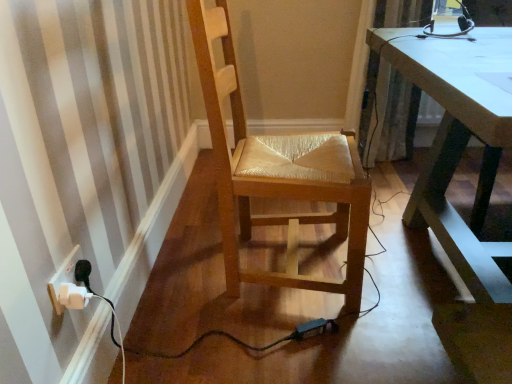
Question: Considering the relative sizes of wooden woven seat at center and textured beige curtain at upper right in the image provided, is wooden woven seat at center wider than textured beige curtain at upper right?

Choices:
 (A) yes
 (B) no

Answer: (A)

Question: Is wooden woven seat at center taller than textured beige curtain at upper right?

Choices:
 (A) no
 (B) yes

Answer: (B)

Question: From a real-world perspective, is wooden woven seat at center physically above textured beige curtain at upper right?

Choices:
 (A) yes
 (B) no

Answer: (A)

Question: From a real-world perspective, is wooden woven seat at center located beneath textured beige curtain at upper right?

Choices:
 (A) yes
 (B) no

Answer: (B)

Question: Is wooden woven seat at center positioned beyond the bounds of textured beige curtain at upper right?

Choices:
 (A) yes
 (B) no

Answer: (A)

Question: Considering the positions of wooden woven seat at center and textured beige curtain at upper right in the image, is wooden woven seat at center bigger or smaller than textured beige curtain at upper right?

Choices:
 (A) small
 (B) big

Answer: (B)

Question: Which is correct: wooden woven seat at center is inside textured beige curtain at upper right, or outside of it?

Choices:
 (A) inside
 (B) outside

Answer: (B)

Question: In terms of height, does wooden woven seat at center look taller or shorter compared to textured beige curtain at upper right?

Choices:
 (A) short
 (B) tall

Answer: (B)

Question: Visually, is wooden woven seat at center positioned to the left or to the right of textured beige curtain at upper right?

Choices:
 (A) right
 (B) left

Answer: (B)

Question: Considering their positions, is white plastic plug at lower left located in front of or behind wooden woven seat at center?

Choices:
 (A) behind
 (B) front

Answer: (B)

Question: Considering the positions of white plastic plug at lower left and wooden woven seat at center in the image, is white plastic plug at lower left taller or shorter than wooden woven seat at center?

Choices:
 (A) tall
 (B) short

Answer: (B)

Question: From a real-world perspective, is white plastic plug at lower left above or below wooden woven seat at center?

Choices:
 (A) above
 (B) below

Answer: (B)

Question: Considering the positions of white plastic plug at lower left and wooden woven seat at center in the image, is white plastic plug at lower left bigger or smaller than wooden woven seat at center?

Choices:
 (A) small
 (B) big

Answer: (A)

Question: Considering the positions of textured beige curtain at upper right and white plastic plug at lower left in the image, is textured beige curtain at upper right wider or thinner than white plastic plug at lower left?

Choices:
 (A) wide
 (B) thin

Answer: (A)

Question: Considering the relative positions of textured beige curtain at upper right and white plastic plug at lower left in the image provided, is textured beige curtain at upper right to the left or to the right of white plastic plug at lower left?

Choices:
 (A) right
 (B) left

Answer: (A)